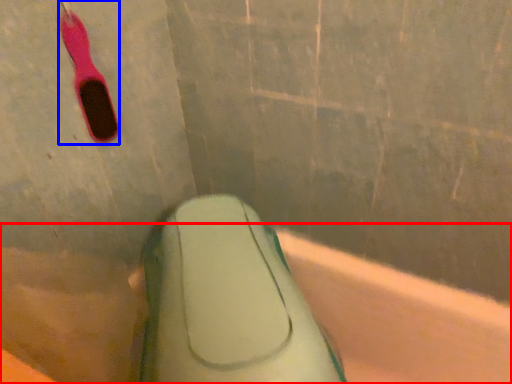
Question: Which object appears farthest to the camera in this image, bath (highlighted by a red box) or toothbrush (highlighted by a blue box)?

Choices:
 (A) bath
 (B) toothbrush

Answer: (B)